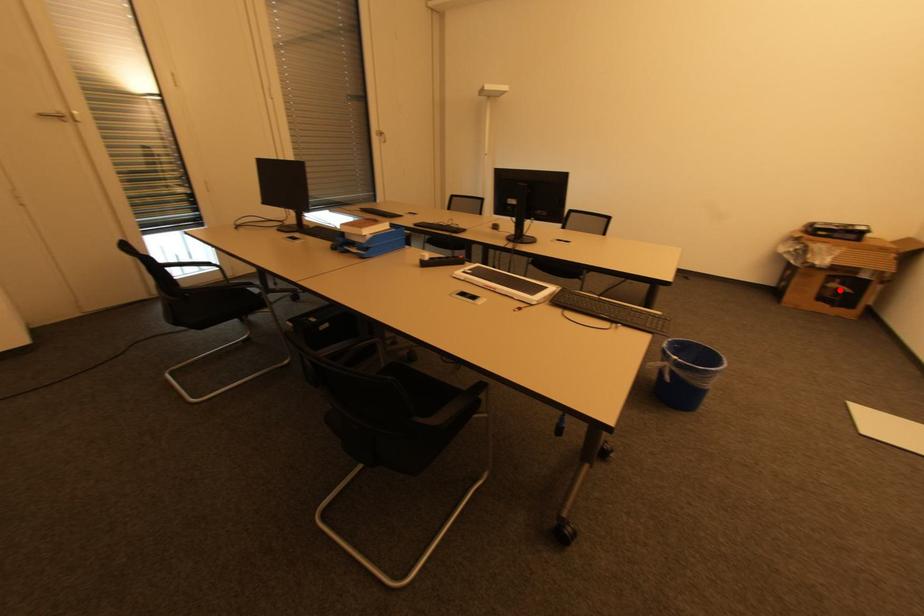
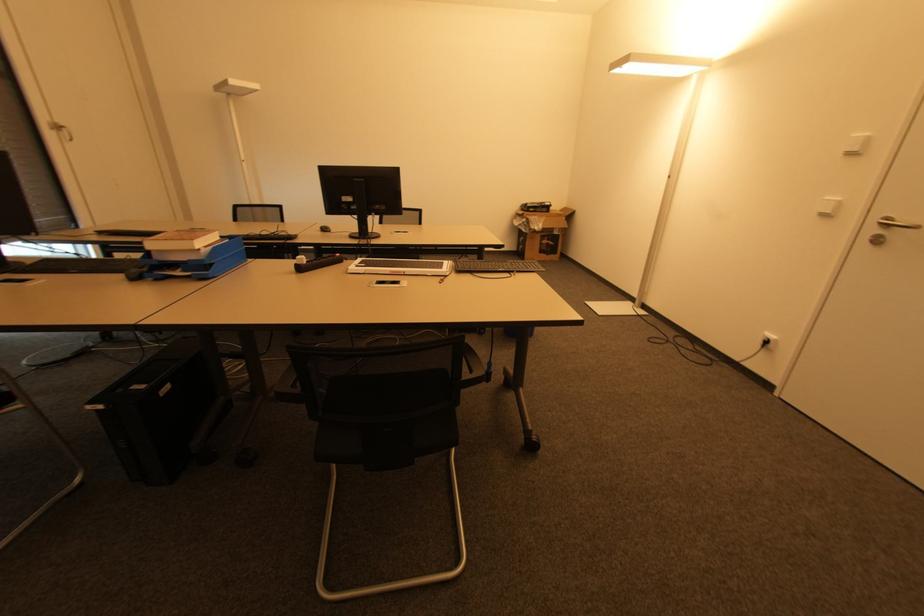
Find the pixel in the second image that matches the highlighted location in the first image.

(550, 245)